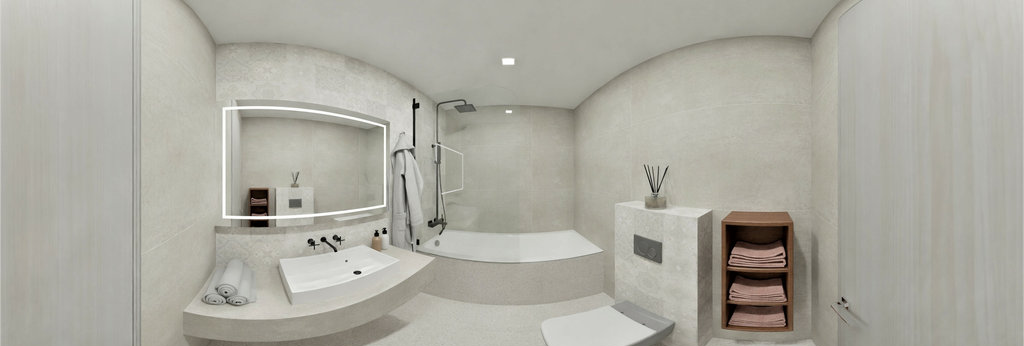
Identify the location of shower head. The image size is (1024, 346). (468, 111).